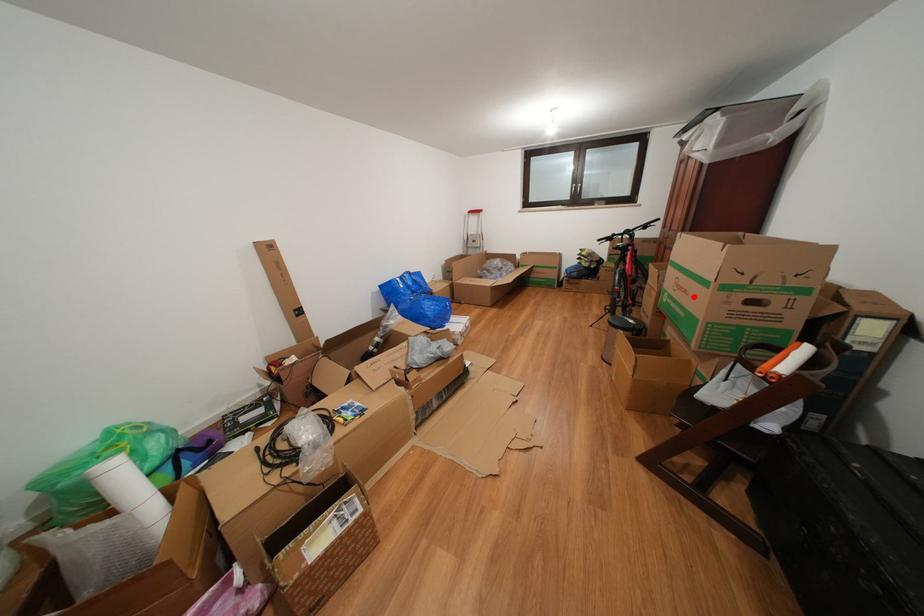
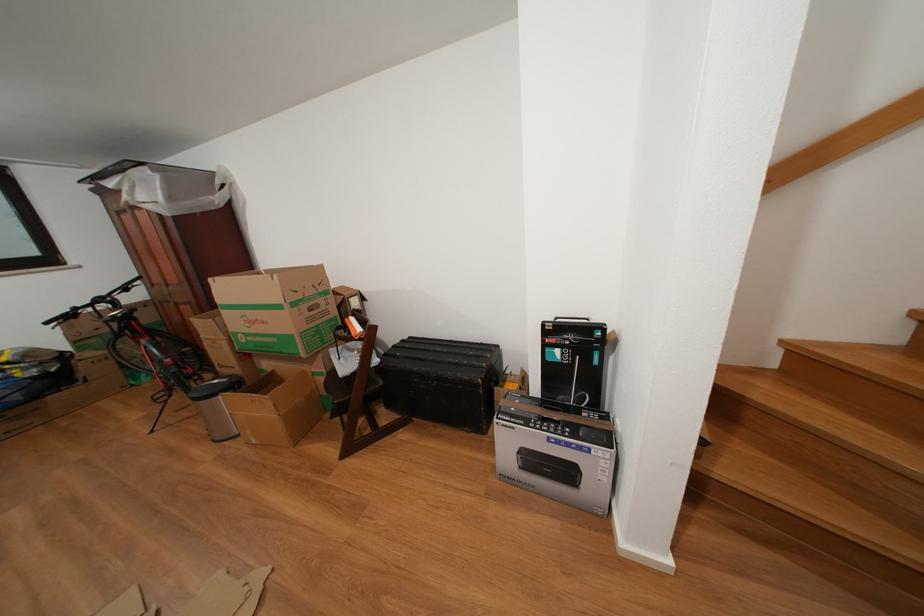
Where in the second image is the point corresponding to the highlighted location from the first image?

(272, 328)